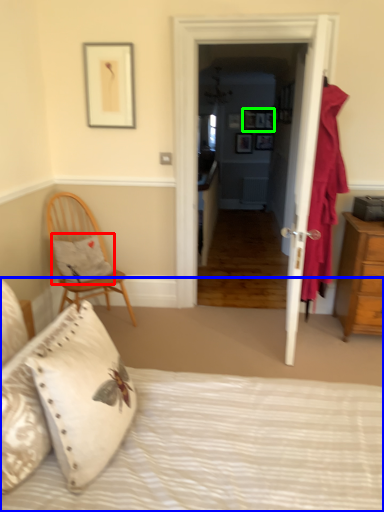
Question: Which object is the farthest from pillow (highlighted by a red box)? Choose among these: bed (highlighted by a blue box) or picture frame (highlighted by a green box).

Choices:
 (A) bed
 (B) picture frame

Answer: (B)